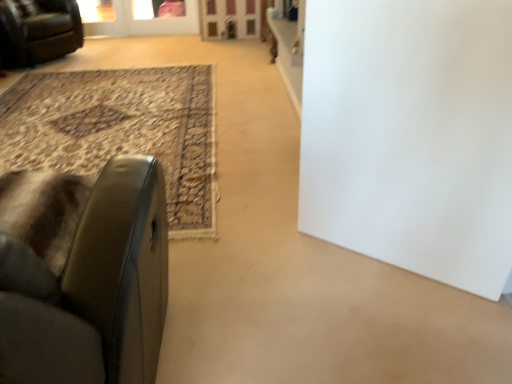
Question: Is leather couch at upper left, acting as the second chair starting from the right, next to transparent glass screen door at upper center, marked as the 1th screen door in a left-to-right arrangement?

Choices:
 (A) no
 (B) yes

Answer: (A)

Question: Considering the relative sizes of leather couch at upper left, which is counted as the first chair, starting from the left, and transparent glass screen door at upper center, positioned as the 2th screen door in right-to-left order, in the image provided, is leather couch at upper left, which is counted as the first chair, starting from the left, taller than transparent glass screen door at upper center, positioned as the 2th screen door in right-to-left order,?

Choices:
 (A) yes
 (B) no

Answer: (A)

Question: Considering the relative positions of leather couch at upper left, which is counted as the second chair, starting from the front, and transparent glass screen door at upper center, positioned as the 2th screen door in right-to-left order, in the image provided, is leather couch at upper left, which is counted as the second chair, starting from the front, to the left of transparent glass screen door at upper center, positioned as the 2th screen door in right-to-left order, from the viewer's perspective?

Choices:
 (A) no
 (B) yes

Answer: (B)

Question: Does leather couch at upper left, the 2th chair in the bottom-to-top sequence, have a larger size compared to transparent glass screen door at upper center, positioned as the 2th screen door in right-to-left order?

Choices:
 (A) yes
 (B) no

Answer: (A)

Question: Is leather couch at upper left, which is counted as the first chair, starting from the left, surrounding transparent glass screen door at upper center, positioned as the 2th screen door in right-to-left order?

Choices:
 (A) no
 (B) yes

Answer: (A)

Question: Does leather couch at upper left, which ranks as the first chair in back-to-front order, turn towards transparent glass screen door at upper center, positioned as the 2th screen door in right-to-left order?

Choices:
 (A) no
 (B) yes

Answer: (A)

Question: Would you say white matte door at center is a long distance from wooden screen door at upper center, the 1th screen door when ordered from right to left?

Choices:
 (A) yes
 (B) no

Answer: (A)

Question: Is white matte door at center bigger than wooden screen door at upper center, the 1th screen door when ordered from right to left?

Choices:
 (A) yes
 (B) no

Answer: (A)

Question: Is white matte door at center thinner than wooden screen door at upper center, arranged as the 2th screen door when viewed from the left?

Choices:
 (A) yes
 (B) no

Answer: (A)

Question: Considering the relative positions of white matte door at center and wooden screen door at upper center, arranged as the 2th screen door when viewed from the left, in the image provided, is white matte door at center to the right of wooden screen door at upper center, arranged as the 2th screen door when viewed from the left, from the viewer's perspective?

Choices:
 (A) no
 (B) yes

Answer: (B)

Question: Could you tell me if white matte door at center is facing wooden screen door at upper center, the 1th screen door when ordered from right to left?

Choices:
 (A) yes
 (B) no

Answer: (B)

Question: Is white matte door at center at the left side of wooden screen door at upper center, arranged as the 2th screen door when viewed from the left?

Choices:
 (A) no
 (B) yes

Answer: (A)

Question: Is leather at left, the first chair viewed from the right, to the right of wooden screen door at upper center, the 1th screen door when ordered from right to left, from the viewer's perspective?

Choices:
 (A) yes
 (B) no

Answer: (B)